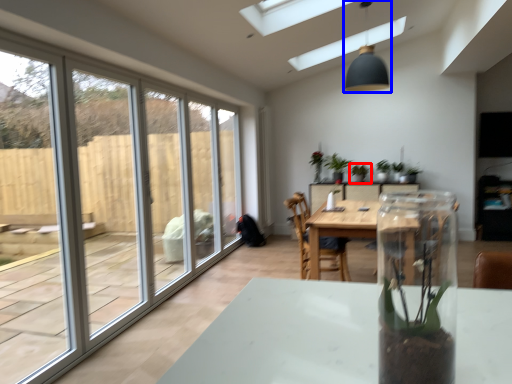
Question: Which object is closer to the camera taking this photo, houseplant (highlighted by a red box) or light fixture (highlighted by a blue box)?

Choices:
 (A) houseplant
 (B) light fixture

Answer: (B)